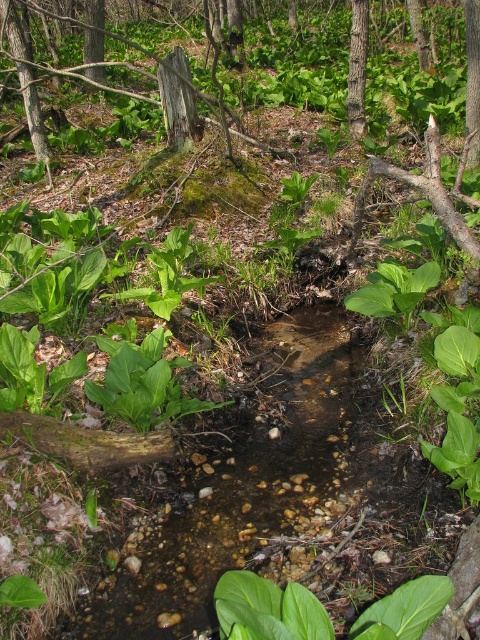
Question: Which point is closer to the camera?

Choices:
 (A) rough bark tree at upper right
 (B) smooth bark tree at center

Answer: (A)

Question: Among these objects, which one is nearest to the camera?

Choices:
 (A) rough bark tree at upper right
 (B) smooth bark tree at center

Answer: (A)

Question: Does smooth bark tree at center come in front of rough bark tree at upper right?

Choices:
 (A) yes
 (B) no

Answer: (B)

Question: Which point is farther to the camera?

Choices:
 (A) smooth bark tree at center
 (B) rough bark tree at upper right

Answer: (A)

Question: Is smooth bark tree at center bigger than rough bark tree at upper right?

Choices:
 (A) yes
 (B) no

Answer: (B)

Question: Is smooth bark tree at center closer to the viewer compared to rough bark tree at upper right?

Choices:
 (A) no
 (B) yes

Answer: (A)